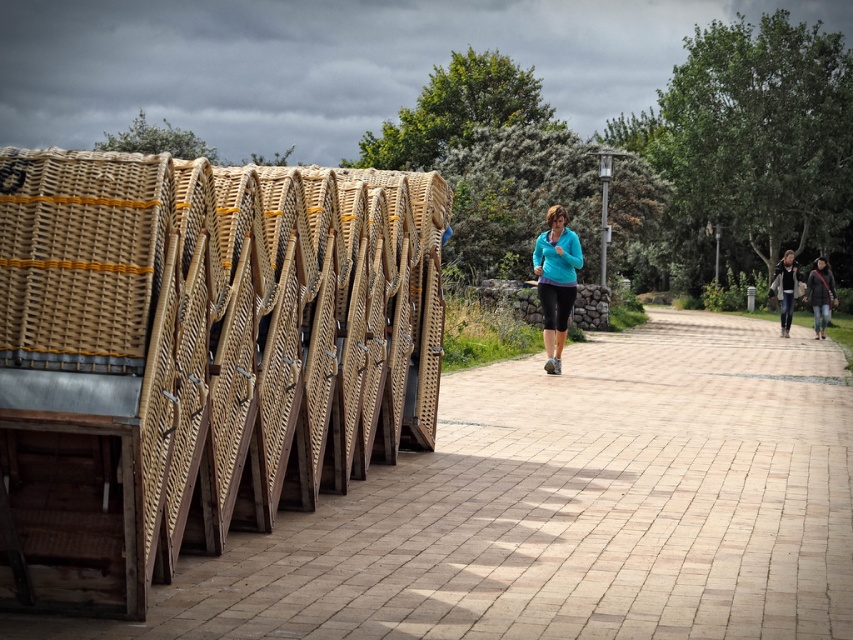
Does woven wood chairs at left appear on the left side of smooth brick pavement at center?

Indeed, woven wood chairs at left is positioned on the left side of smooth brick pavement at center.

Is woven wood chairs at left further to the viewer compared to smooth brick pavement at center?

No, it is in front of smooth brick pavement at center.

Which is behind, point (183, 179) or point (459, 502)?

Point (459, 502)

Where is `woven wood chairs at left`? Image resolution: width=853 pixels, height=640 pixels. woven wood chairs at left is located at coordinates (196, 355).

Based on the photo, can you confirm if smooth brick pavement at center is taller than dark gray textured jacket at right?

Incorrect, smooth brick pavement at center's height is not larger of dark gray textured jacket at right's.

Is smooth brick pavement at center in front of dark gray textured jacket at right?

Yes, smooth brick pavement at center is in front of dark gray textured jacket at right.

Image resolution: width=853 pixels, height=640 pixels. Find the location of `smooth brick pavement at center`. smooth brick pavement at center is located at coordinates (566, 508).

Which of these two, woven wood chairs at left or teal fleece jacket at center, stands shorter?

teal fleece jacket at center is shorter.

In order to click on woven wood chairs at left in this screenshot , I will do `click(196, 355)`.

Identify the location of woven wood chairs at left. The width and height of the screenshot is (853, 640). (196, 355).